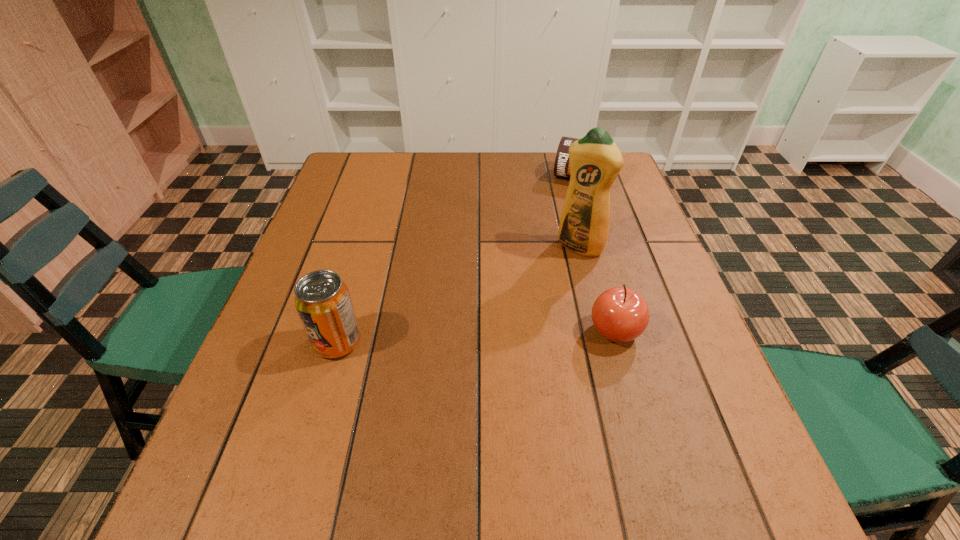
This screenshot has width=960, height=540. In the image, there is a desktop. Find the location of `free space at the far edge`. free space at the far edge is located at coordinates (435, 189).

This screenshot has height=540, width=960. In the image, there is a desktop. What are the coordinates of `vacant space at the near edge` in the screenshot? It's located at (368, 408).

In order to click on free space at the left edge in this screenshot , I will do pyautogui.click(x=319, y=373).

Find the location of a particular element. Image resolution: width=960 pixels, height=540 pixels. free space at the right edge of the desktop is located at coordinates (645, 292).

You are a GUI agent. You are given a task and a screenshot of the screen. Output one action in this format:
    pyautogui.click(x=<x>, y=<y>)
    Task: Click on the free location at the far left corner of the desktop
    Image resolution: width=960 pixels, height=540 pixels.
    Given the screenshot: What is the action you would take?
    pyautogui.click(x=376, y=177)

Where is `vacant region at the near right corner`? Image resolution: width=960 pixels, height=540 pixels. vacant region at the near right corner is located at coordinates coord(660,433).

This screenshot has height=540, width=960. Find the location of `free spot between the apple and the detergent`. free spot between the apple and the detergent is located at coordinates (597, 289).

Locate an element on the screen. free space between the apple and the second farthest object is located at coordinates (597, 289).

This screenshot has height=540, width=960. In order to click on vacant area that lies between the apple and the detergent in this screenshot , I will do `click(597, 289)`.

The height and width of the screenshot is (540, 960). Identify the location of empty space that is in between the leftmost object and the apple. (476, 336).